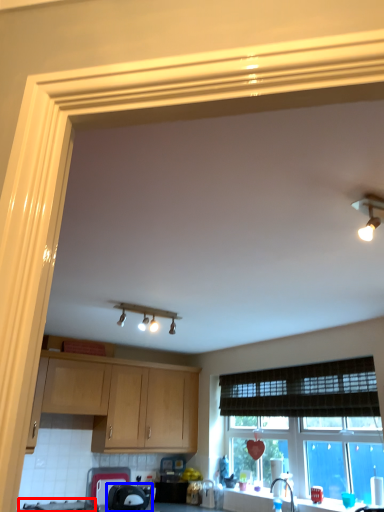
Question: Among these objects, which one is nearest to the camera, gas stove (highlighted by a red box) or appliance (highlighted by a blue box)?

Choices:
 (A) gas stove
 (B) appliance

Answer: (A)